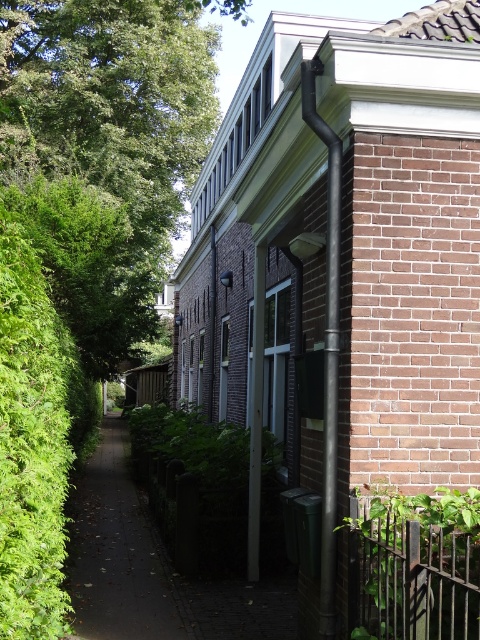
Question: Which of these objects is positioned farthest from the black metal fence at lower right?

Choices:
 (A) dark brown paved path at center
 (B) black matte pipe at upper right

Answer: (A)

Question: Which point is farther to the camera?

Choices:
 (A) (80, 586)
 (B) (332, 250)
 (C) (351, 637)

Answer: (A)

Question: Is dark brown paved path at center positioned behind black metal fence at lower right?

Choices:
 (A) no
 (B) yes

Answer: (B)

Question: Is black metal fence at lower right below black matte pipe at upper right?

Choices:
 (A) yes
 (B) no

Answer: (A)

Question: In this image, where is dark brown paved path at center located relative to black metal fence at lower right?

Choices:
 (A) below
 (B) above

Answer: (A)

Question: Estimate the real-world distances between objects in this image. Which object is farther from the black matte pipe at upper right?

Choices:
 (A) black metal fence at lower right
 (B) dark brown paved path at center

Answer: (B)